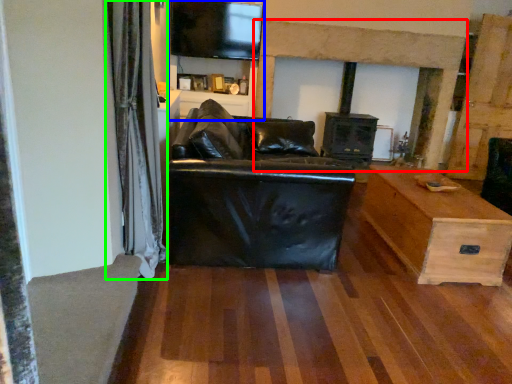
Question: Based on their relative distances, which object is nearer to fireplace (highlighted by a red box)? Choose from entertainment center (highlighted by a blue box) and curtain (highlighted by a green box).

Choices:
 (A) entertainment center
 (B) curtain

Answer: (A)